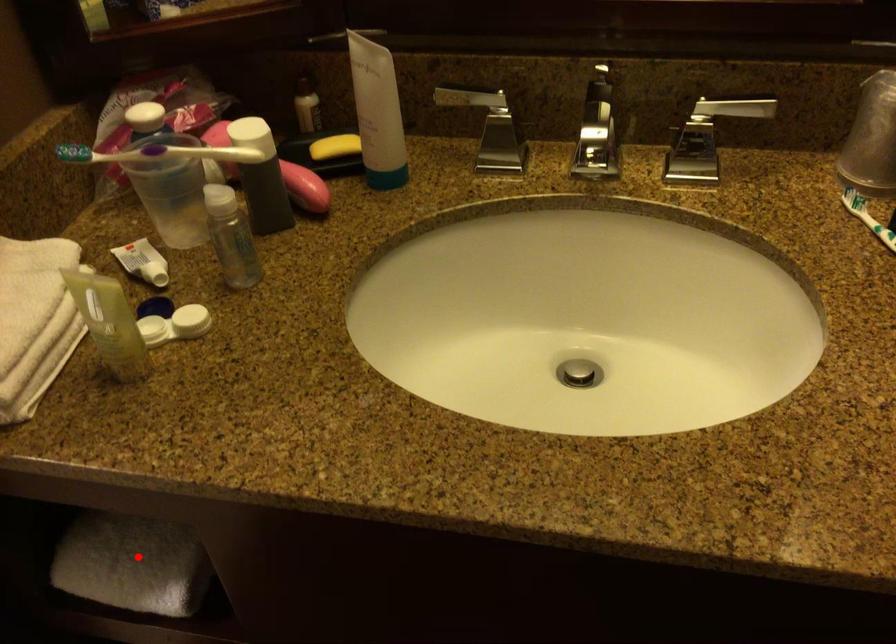
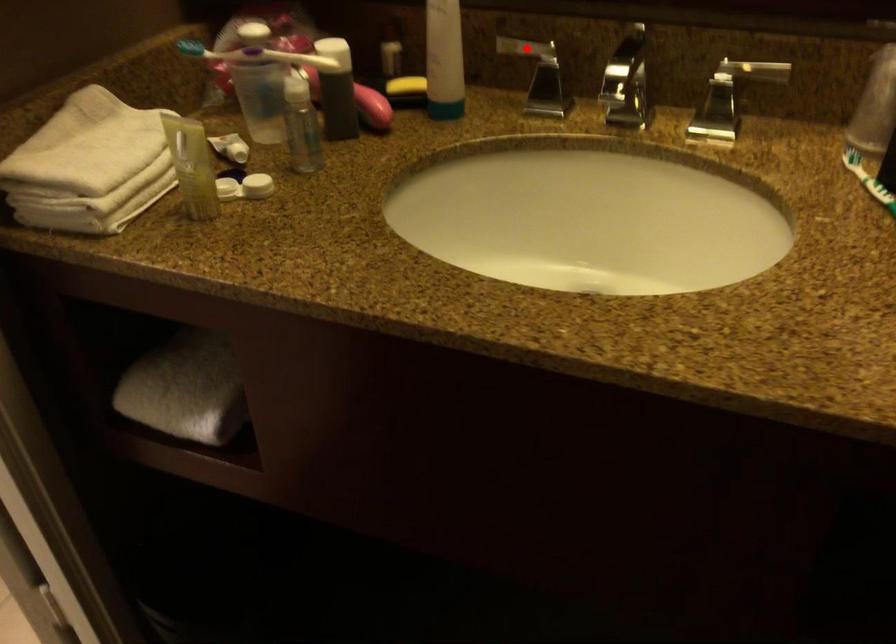
I am providing you with two images of the same scene from different viewpoints. A red point is marked on the first image and another point is marked on the second image. Are the points marked in image1 and image2 representing the same 3D position?

No